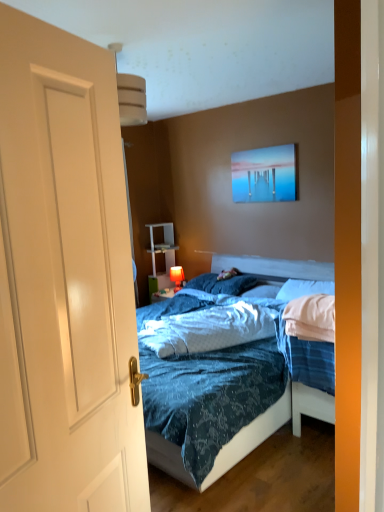
Question: From a real-world perspective, is white soft pillow at center, placed as the 3th pillow when sorted from left to right, positioned under white soft pillow at center, the 2th pillow when ordered from right to left, based on gravity?

Choices:
 (A) yes
 (B) no

Answer: (B)

Question: Is white soft pillow at center, acting as the 1th pillow starting from the right, to the right of white soft pillow at center, the 2th pillow when ordered from right to left, from the viewer's perspective?

Choices:
 (A) no
 (B) yes

Answer: (B)

Question: Is white soft pillow at center, acting as the 1th pillow starting from the right, touching white soft pillow at center, the 2th pillow when ordered from right to left?

Choices:
 (A) yes
 (B) no

Answer: (B)

Question: From the image's perspective, would you say white soft pillow at center, placed as the 3th pillow when sorted from left to right, is shown under white soft pillow at center, marked as the second pillow in a left-to-right arrangement?

Choices:
 (A) yes
 (B) no

Answer: (B)

Question: From a real-world perspective, is white soft pillow at center, acting as the 1th pillow starting from the right, positioned over white soft pillow at center, the 2th pillow when ordered from right to left, based on gravity?

Choices:
 (A) no
 (B) yes

Answer: (B)

Question: Is white glossy door at center inside or outside of white glossy shelf at center?

Choices:
 (A) outside
 (B) inside

Answer: (A)

Question: In terms of size, does white glossy door at center appear bigger or smaller than white glossy shelf at center?

Choices:
 (A) big
 (B) small

Answer: (B)

Question: Is point (87, 425) positioned closer to the camera than point (163, 273)?

Choices:
 (A) farther
 (B) closer

Answer: (B)

Question: From the image's perspective, is white glossy door at center located above or below white glossy shelf at center?

Choices:
 (A) above
 (B) below

Answer: (B)

Question: From the image's perspective, is metallic glossy picture frame at upper center located above or below white soft pillow at center, acting as the 1th pillow starting from the right?

Choices:
 (A) above
 (B) below

Answer: (A)

Question: From a real-world perspective, is metallic glossy picture frame at upper center above or below white soft pillow at center, placed as the 3th pillow when sorted from left to right?

Choices:
 (A) above
 (B) below

Answer: (A)

Question: Considering the positions of metallic glossy picture frame at upper center and white soft pillow at center, acting as the 1th pillow starting from the right, in the image, is metallic glossy picture frame at upper center wider or thinner than white soft pillow at center, acting as the 1th pillow starting from the right,?

Choices:
 (A) thin
 (B) wide

Answer: (A)

Question: Considering the relative positions of metallic glossy picture frame at upper center and white soft pillow at center, acting as the 1th pillow starting from the right, in the image provided, is metallic glossy picture frame at upper center to the left or to the right of white soft pillow at center, acting as the 1th pillow starting from the right,?

Choices:
 (A) left
 (B) right

Answer: (A)

Question: Is white soft pillow at center, the 2th pillow when ordered from right to left, taller or shorter than white glossy door at center?

Choices:
 (A) tall
 (B) short

Answer: (B)

Question: Do you think white soft pillow at center, marked as the second pillow in a left-to-right arrangement, is within white glossy door at center, or outside of it?

Choices:
 (A) inside
 (B) outside

Answer: (B)